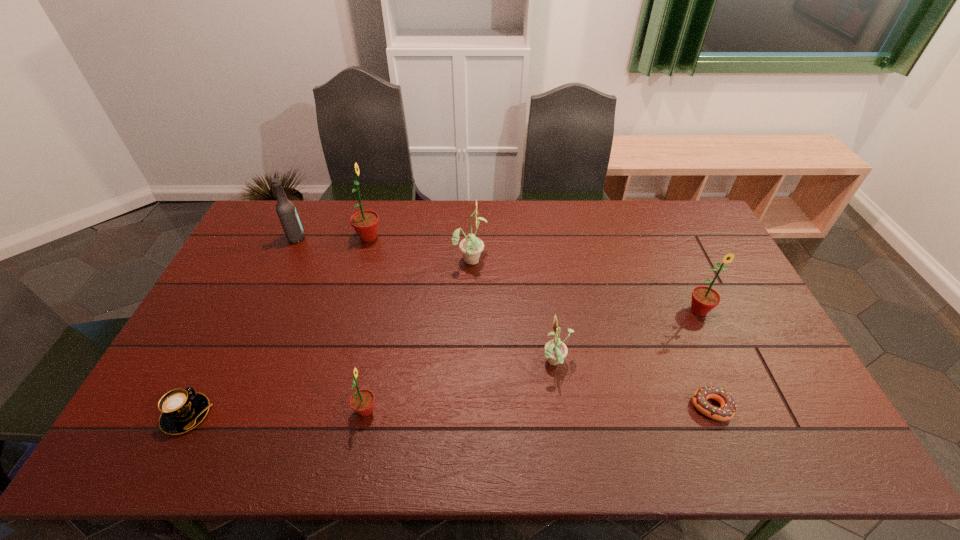
Locate an element on the screen. blank area located on the front-facing side of the fourth farthest sunflower is located at coordinates (477, 363).

This screenshot has width=960, height=540. In order to click on vacant space situated on the front-facing side of the fourth farthest sunflower in this screenshot , I will do click(448, 363).

Find the location of a particular element. free space located 0.220m on the face of the second green sunflower from right to left is located at coordinates (466, 410).

Identify the location of free space located 0.360m on the right of the second shortest object. (355, 415).

I want to click on vacant space located on the left of the brown doughnut, so click(x=592, y=407).

Image resolution: width=960 pixels, height=540 pixels. Find the location of `sunflower at the far edge`. sunflower at the far edge is located at coordinates (365, 222).

Where is `beer bottle located in the far edge section of the desktop`? This screenshot has width=960, height=540. beer bottle located in the far edge section of the desktop is located at coordinates pos(286,211).

Image resolution: width=960 pixels, height=540 pixels. I want to click on object located at the near edge, so tap(181, 410).

Where is `beer bottle at the left edge`? This screenshot has height=540, width=960. beer bottle at the left edge is located at coordinates (286, 211).

Find the location of `cappuccino that is at the left edge`. cappuccino that is at the left edge is located at coordinates (181, 410).